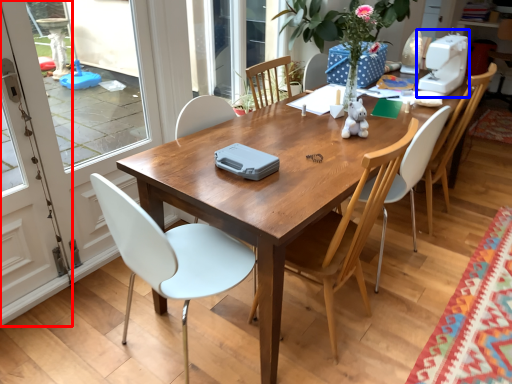
Question: Which object appears closest to the camera in this image, screen door (highlighted by a red box) or sewing machine (highlighted by a blue box)?

Choices:
 (A) screen door
 (B) sewing machine

Answer: (A)